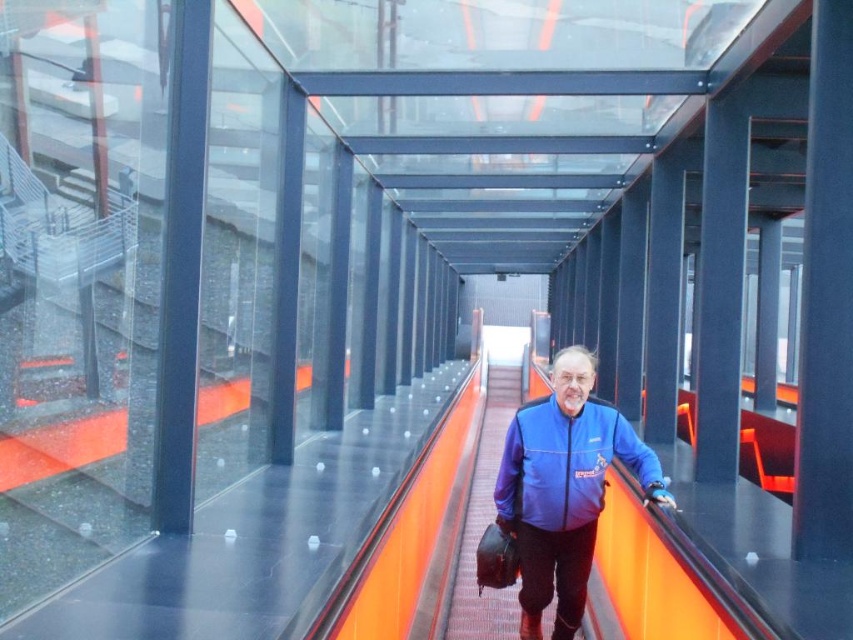
From the picture: Can you confirm if blue fabric jacket at center is positioned above blue fleece jacket at center?

No, blue fabric jacket at center is not above blue fleece jacket at center.

Can you confirm if blue fabric jacket at center is bigger than blue fleece jacket at center?

Yes, blue fabric jacket at center is bigger than blue fleece jacket at center.

Describe the element at coordinates (563, 488) in the screenshot. Image resolution: width=853 pixels, height=640 pixels. I see `blue fabric jacket at center` at that location.

The width and height of the screenshot is (853, 640). Identify the location of blue fabric jacket at center. (563, 488).